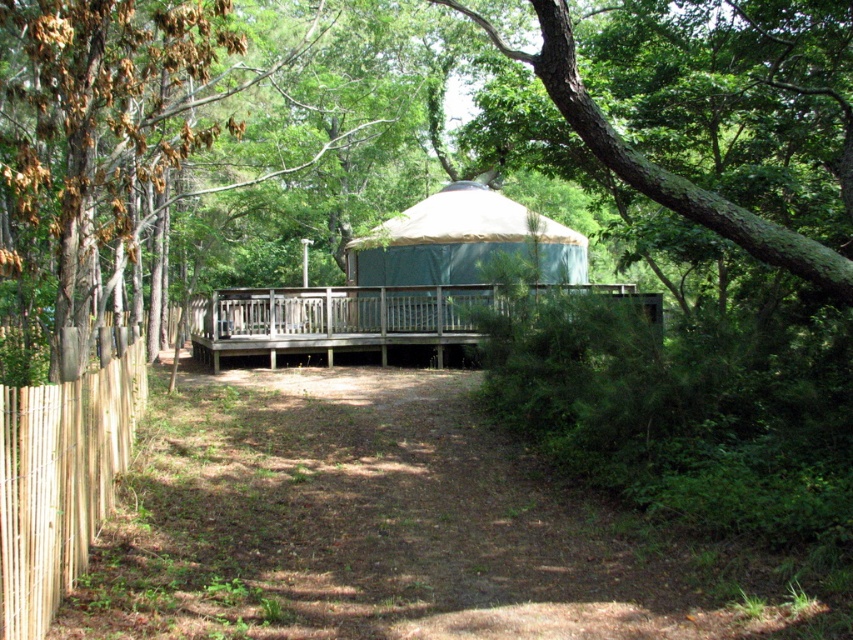
In the scene shown: You are standing in front of the yurt and want to determine the relative positions of two points marked in the scene. Which point is closer to you, point (555, 253) or point (630, 168)?

Point (555, 253) is further to the viewer than point (630, 168), so point (630, 168) is closer to you.

You are planning to install a solar panel on the tallest structure between the light brown wooden fence at left and the beige canvas yurt at center. Which structure should you choose?

The beige canvas yurt at center is taller than the light brown wooden fence at left, so you should install the solar panel on the beige canvas yurt at center.

You are planning to set up a small garden on the wooden deck at center. Considering the position of the green rough bark tree at upper center, will the deck receive enough sunlight throughout the day?

The wooden deck at center is positioned under the green rough bark tree at upper center, which likely blocks some sunlight. The deck may not receive enough sunlight for a garden that requires full sun exposure.